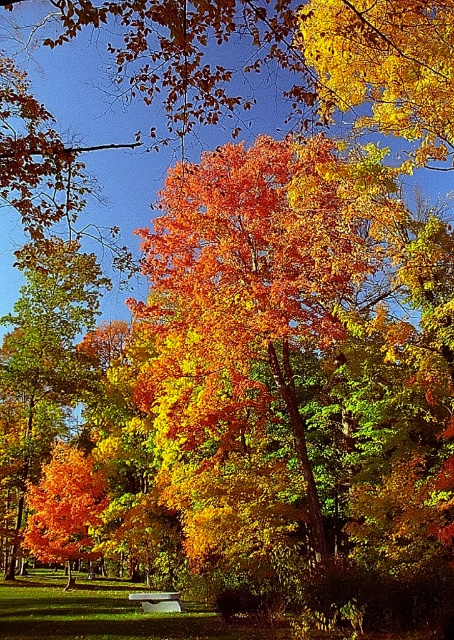
Can you confirm if shiny orange leaves at center is positioned to the left of white stone bench at center?

No, shiny orange leaves at center is not to the left of white stone bench at center.

Which is behind, point (162, 436) or point (167, 593)?

Positioned behind is point (167, 593).

The image size is (454, 640). Identify the location of shiny orange leaves at center. (245, 317).

Can you confirm if shiny orange leaves at left is wider than white stone bench at center?

Yes.

Between point (26, 484) and point (171, 602), which one is positioned behind?

Positioned behind is point (26, 484).

Measure the distance between shiny orange leaves at left and camera.

shiny orange leaves at left and camera are 10.55 meters apart.

Find the location of a particular element. The width and height of the screenshot is (454, 640). shiny orange leaves at left is located at coordinates (40, 371).

Based on the photo, is shiny orange leaves at center above shiny orange leaves at left?

Correct, shiny orange leaves at center is located above shiny orange leaves at left.

Between shiny orange leaves at center and shiny orange leaves at left, which one appears on the right side from the viewer's perspective?

From the viewer's perspective, shiny orange leaves at center appears more on the right side.

This screenshot has width=454, height=640. What do you see at coordinates (245, 317) in the screenshot?
I see `shiny orange leaves at center` at bounding box center [245, 317].

Locate an element on the screen. shiny orange leaves at center is located at coordinates (245, 317).